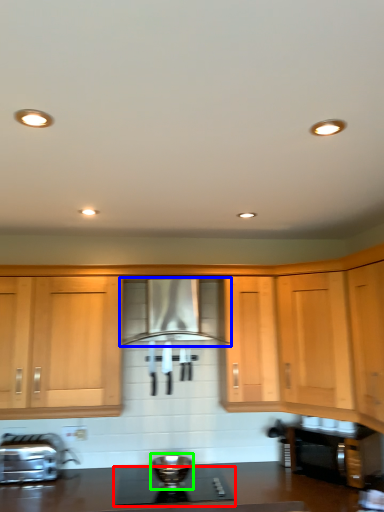
Question: Which is farther away from gas stove (highlighted by a red box)? home appliance (highlighted by a blue box) or appliance (highlighted by a green box)?

Choices:
 (A) home appliance
 (B) appliance

Answer: (A)